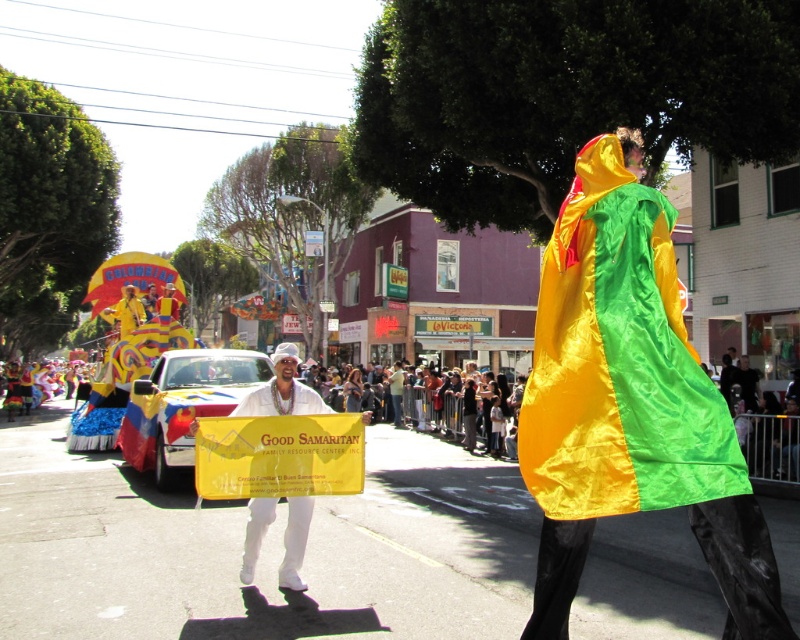
Is shiny satin cape at center further to the viewer compared to white satin banner at center?

No.

Between shiny satin cape at center and white satin banner at center, which one appears on the left side from the viewer's perspective?

From the viewer's perspective, white satin banner at center appears more on the left side.

Measure the distance between point (594,436) and camera.

Point (594,436) and camera are 2.99 meters apart from each other.

You are a GUI agent. You are given a task and a screenshot of the screen. Output one action in this format:
    pyautogui.click(x=<x>, y=<y>)
    Task: Click on the shiny satin cape at center
    This screenshot has width=800, height=640.
    Given the screenshot: What is the action you would take?
    pyautogui.click(x=630, y=401)